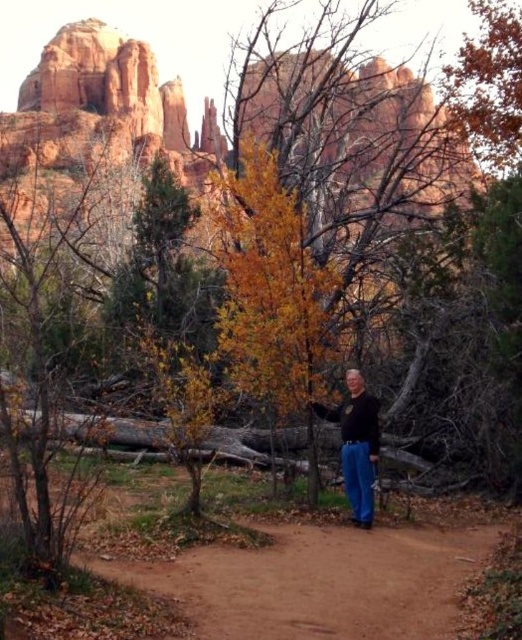
Where is `brown dirt path at center`? The width and height of the screenshot is (522, 640). brown dirt path at center is located at coordinates (257, 570).

Can you confirm if brown dirt path at center is shorter than black matte shirt at center?

Yes.

Who is more forward, (452, 552) or (352, 456)?

Point (452, 552) is in front.

Identify the location of brown dirt path at center. The image size is (522, 640). (257, 570).